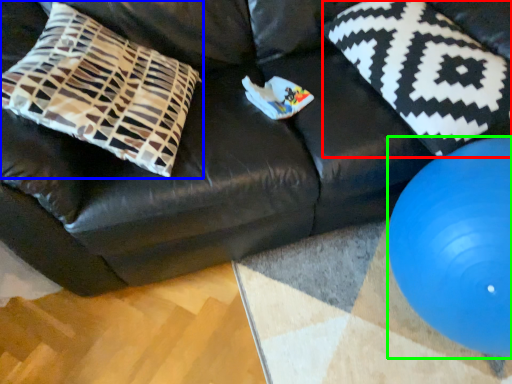
Question: Which object is positioned closest to pillow (highlighted by a red box)? Select from pillow (highlighted by a blue box) and ball (highlighted by a green box).

Choices:
 (A) pillow
 (B) ball

Answer: (B)